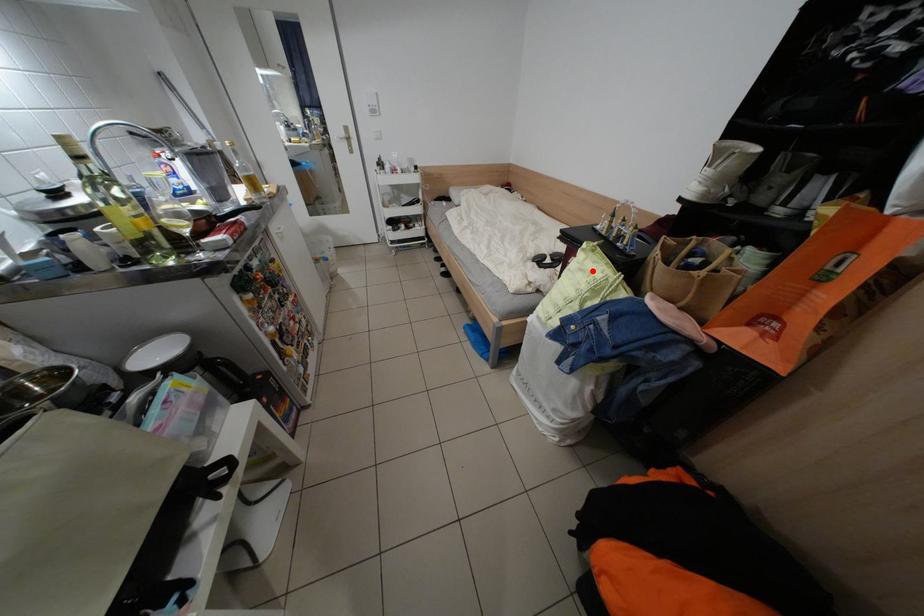
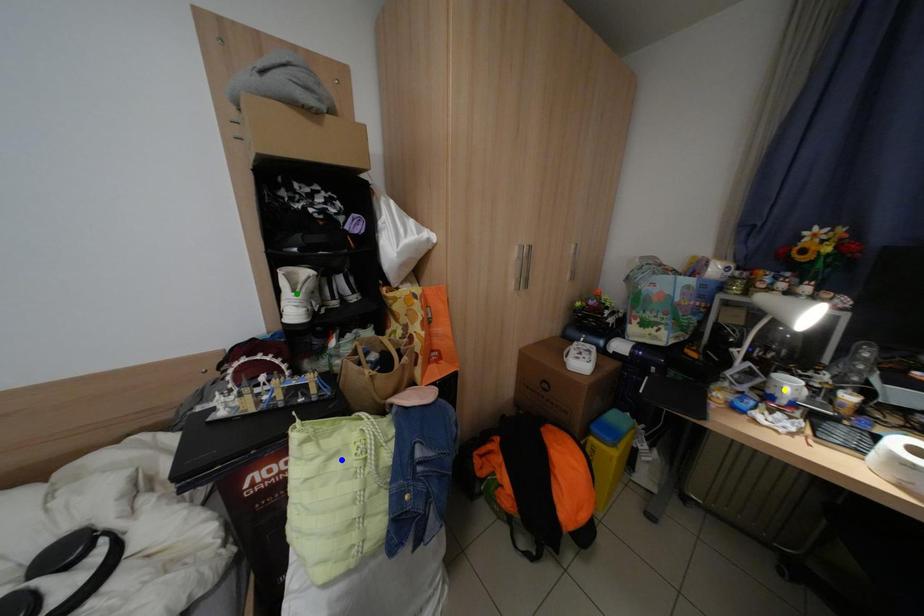
Question: I am providing you with two images of the same scene from different viewpoints. A red point is marked on the first image. You are given multiple points on the second image. Can you choose the point in image 2 that corresponds to the point in image 1?

Choices:
 (A) yellow point
 (B) blue point
 (C) green point

Answer: (B)